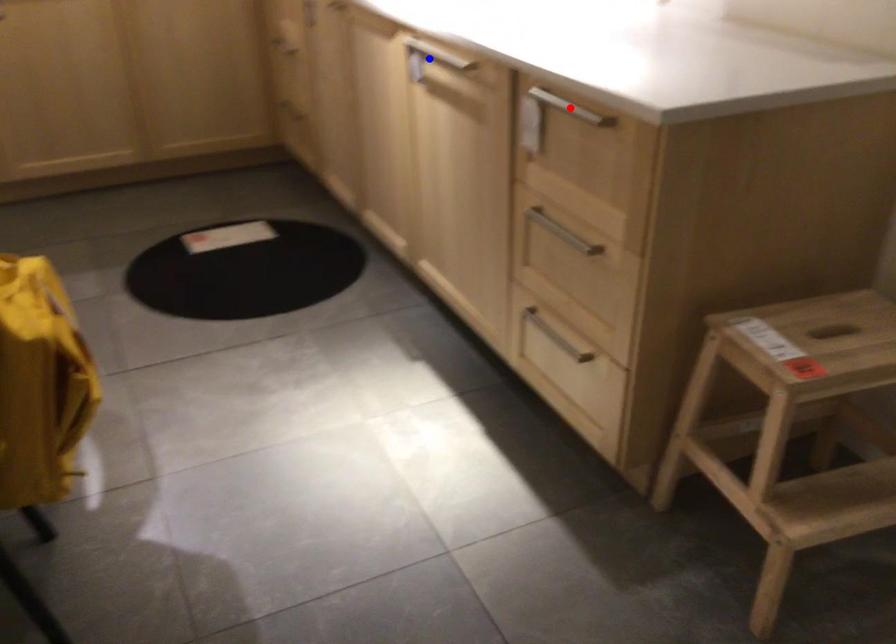
Question: In the image, two points are highlighted. Which point is nearer to the camera? Reply with the corresponding letter.

Choices:
 (A) blue point
 (B) red point

Answer: (B)